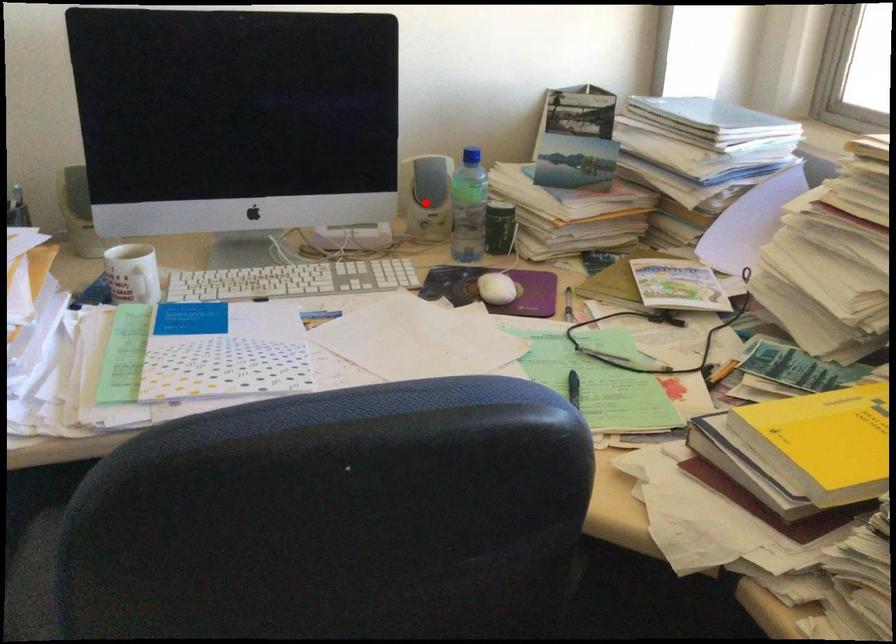
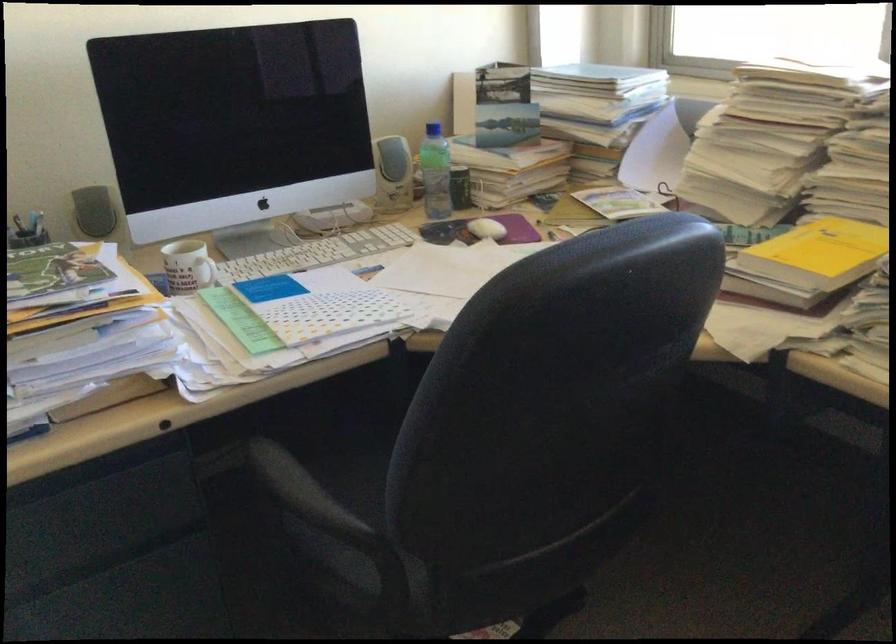
The point at the highlighted location is marked in the first image. Where is the corresponding point in the second image?

(392, 174)